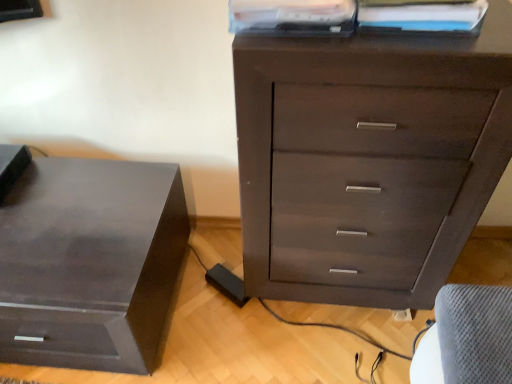
In order to click on matte plastic book at upper center, which is the first book in left-to-right order in this screenshot , I will do `click(293, 17)`.

Describe the element at coordinates (368, 160) in the screenshot. This screenshot has width=512, height=384. I see `dark wood chest of drawers at center` at that location.

Consider the image. What is the approximate width of matte black nightstand at left?

matte black nightstand at left is 26.99 inches wide.

The image size is (512, 384). I want to click on white paper at upper center, the second book viewed from the left, so click(x=421, y=14).

Could you tell me if white paper at upper center, positioned as the first book in right-to-left order, is turned towards matte plastic book at upper center, the 2th book in the right-to-left sequence?

No.

Can you confirm if white paper at upper center, the second book viewed from the left, is bigger than matte plastic book at upper center, which is the first book in left-to-right order?

Actually, white paper at upper center, the second book viewed from the left, might be smaller than matte plastic book at upper center, which is the first book in left-to-right order.

Does point (433, 7) come farther from viewer compared to point (335, 5)?

Yes, it is behind point (335, 5).

Would you say white paper at upper center, positioned as the first book in right-to-left order, is inside or outside matte plastic book at upper center, the 2th book in the right-to-left sequence?

white paper at upper center, positioned as the first book in right-to-left order, is outside matte plastic book at upper center, the 2th book in the right-to-left sequence.

Is matte plastic book at upper center, the 2th book in the right-to-left sequence, spatially inside white paper at upper center, positioned as the first book in right-to-left order, or outside of it?

matte plastic book at upper center, the 2th book in the right-to-left sequence, is not inside white paper at upper center, positioned as the first book in right-to-left order, it's outside.

Is white paper at upper center, positioned as the first book in right-to-left order, at the back of matte plastic book at upper center, the 2th book in the right-to-left sequence?

No, matte plastic book at upper center, the 2th book in the right-to-left sequence, is not facing away from white paper at upper center, positioned as the first book in right-to-left order.

From the image's perspective, between matte plastic book at upper center, the 2th book in the right-to-left sequence, and white paper at upper center, the second book viewed from the left, who is located below?

white paper at upper center, the second book viewed from the left.

Which is more to the right, matte plastic book at upper center, which is the first book in left-to-right order, or white paper at upper center, the second book viewed from the left?

Positioned to the right is white paper at upper center, the second book viewed from the left.

Considering the points (400, 13) and (130, 233), which point is behind, point (400, 13) or point (130, 233)?

Point (130, 233)

How many degrees apart are the facing directions of white paper at upper center, positioned as the first book in right-to-left order, and matte black nightstand at left?

white paper at upper center, positioned as the first book in right-to-left order, and matte black nightstand at left are facing 1.21 degrees away from each other.

From the image's perspective, is white paper at upper center, the second book viewed from the left, under matte black nightstand at left?

No, from the image's perspective, white paper at upper center, the second book viewed from the left, is not below matte black nightstand at left.

From the picture: Is white paper at upper center, positioned as the first book in right-to-left order, to the right of matte black nightstand at left from the viewer's perspective?

Indeed, white paper at upper center, positioned as the first book in right-to-left order, is positioned on the right side of matte black nightstand at left.

Locate an element on the screen. This screenshot has height=384, width=512. chest of drawers to the left of white paper at upper center, the second book viewed from the left is located at coordinates (368, 160).

Is dark wood chest of drawers at center to the left or to the right of white paper at upper center, the second book viewed from the left, in the image?

From the image, it's evident that dark wood chest of drawers at center is to the left of white paper at upper center, the second book viewed from the left.

Which of these two, dark wood chest of drawers at center or white paper at upper center, positioned as the first book in right-to-left order, is bigger?

dark wood chest of drawers at center is bigger.

Is dark wood chest of drawers at center positioned with its back to white paper at upper center, positioned as the first book in right-to-left order?

dark wood chest of drawers at center is not turned away from white paper at upper center, positioned as the first book in right-to-left order.

Who is shorter, matte black nightstand at left or matte plastic book at upper center, which is the first book in left-to-right order?

Standing shorter between the two is matte plastic book at upper center, which is the first book in left-to-right order.

In the scene shown: Which is behind, matte black nightstand at left or matte plastic book at upper center, the 2th book in the right-to-left sequence?

matte black nightstand at left is behind.

Is matte black nightstand at left next to matte plastic book at upper center, the 2th book in the right-to-left sequence, and touching it?

No, matte black nightstand at left is not beside matte plastic book at upper center, the 2th book in the right-to-left sequence.

Is matte black nightstand at left oriented away from matte plastic book at upper center, the 2th book in the right-to-left sequence?

No, matte black nightstand at left is not facing the opposite direction of matte plastic book at upper center, the 2th book in the right-to-left sequence.

Is white paper at upper center, the second book viewed from the left, in contact with dark wood chest of drawers at center?

They are not placed beside each other.

Could you tell me if white paper at upper center, positioned as the first book in right-to-left order, is facing dark wood chest of drawers at center?

No, white paper at upper center, positioned as the first book in right-to-left order, is not facing towards dark wood chest of drawers at center.

Considering the sizes of objects white paper at upper center, the second book viewed from the left, and dark wood chest of drawers at center in the image provided, who is taller, white paper at upper center, the second book viewed from the left, or dark wood chest of drawers at center?

Standing taller between the two is dark wood chest of drawers at center.

Is white paper at upper center, positioned as the first book in right-to-left order, not within dark wood chest of drawers at center?

That's correct, white paper at upper center, positioned as the first book in right-to-left order, is outside of dark wood chest of drawers at center.

From the picture: From the image's perspective, is matte plastic book at upper center, the 2th book in the right-to-left sequence, above or below matte black nightstand at left?

matte plastic book at upper center, the 2th book in the right-to-left sequence, is situated higher than matte black nightstand at left in the image.

Is matte black nightstand at left at the back of matte plastic book at upper center, which is the first book in left-to-right order?

No, matte black nightstand at left is not at the back of matte plastic book at upper center, which is the first book in left-to-right order.

Considering the positions of objects matte plastic book at upper center, the 2th book in the right-to-left sequence, and matte black nightstand at left in the image provided, who is more to the right, matte plastic book at upper center, the 2th book in the right-to-left sequence, or matte black nightstand at left?

From the viewer's perspective, matte plastic book at upper center, the 2th book in the right-to-left sequence, appears more on the right side.

Are matte plastic book at upper center, the 2th book in the right-to-left sequence, and matte black nightstand at left beside each other?

matte plastic book at upper center, the 2th book in the right-to-left sequence, and matte black nightstand at left are not in contact.

At what (x,y) coordinates should I click in order to perform the action: click on book lying in front of the white paper at upper center, positioned as the first book in right-to-left order. Please return your answer as a coordinate pair (x, y). Image resolution: width=512 pixels, height=384 pixels. Looking at the image, I should click on (293, 17).

Locate an element on the screen. This screenshot has height=384, width=512. book that appears below the matte plastic book at upper center, which is the first book in left-to-right order (from the image's perspective) is located at coordinates (421, 14).

Considering their positions, is matte plastic book at upper center, the 2th book in the right-to-left sequence, positioned closer to matte black nightstand at left than white paper at upper center, positioned as the first book in right-to-left order?

matte plastic book at upper center, the 2th book in the right-to-left sequence, is closer to matte black nightstand at left.

Estimate the real-world distances between objects in this image. Which object is further from matte black nightstand at left, dark wood chest of drawers at center or white paper at upper center, positioned as the first book in right-to-left order?

The object further to matte black nightstand at left is white paper at upper center, positioned as the first book in right-to-left order.

When comparing their distances from matte black nightstand at left, does matte plastic book at upper center, which is the first book in left-to-right order, or dark wood chest of drawers at center seem further?

matte plastic book at upper center, which is the first book in left-to-right order, is further to matte black nightstand at left.

From the image, which object appears to be farther from matte plastic book at upper center, the 2th book in the right-to-left sequence, dark wood chest of drawers at center or white paper at upper center, positioned as the first book in right-to-left order?

dark wood chest of drawers at center.

Based on their spatial positions, is dark wood chest of drawers at center or matte plastic book at upper center, which is the first book in left-to-right order, further from matte black nightstand at left?

The object further to matte black nightstand at left is matte plastic book at upper center, which is the first book in left-to-right order.

Looking at the image, which one is located closer to white paper at upper center, positioned as the first book in right-to-left order, matte plastic book at upper center, the 2th book in the right-to-left sequence, or matte black nightstand at left?

The object closer to white paper at upper center, positioned as the first book in right-to-left order, is matte plastic book at upper center, the 2th book in the right-to-left sequence.

Estimate the real-world distances between objects in this image. Which object is further from dark wood chest of drawers at center, matte black nightstand at left or matte plastic book at upper center, which is the first book in left-to-right order?

matte black nightstand at left lies further to dark wood chest of drawers at center than the other object.

Looking at this image, based on their spatial positions, is matte black nightstand at left or matte plastic book at upper center, the 2th book in the right-to-left sequence, further from white paper at upper center, positioned as the first book in right-to-left order?

matte black nightstand at left lies further to white paper at upper center, positioned as the first book in right-to-left order, than the other object.

The image size is (512, 384). I want to click on chest of drawers between matte black nightstand at left and white paper at upper center, the second book viewed from the left, in the horizontal direction, so click(368, 160).

This screenshot has width=512, height=384. What are the coordinates of `book between matte plastic book at upper center, the 2th book in the right-to-left sequence, and dark wood chest of drawers at center, in the vertical direction` in the screenshot? It's located at (421, 14).

Identify the location of book between matte black nightstand at left and dark wood chest of drawers at center. (293, 17).

In order to click on book between matte black nightstand at left and white paper at upper center, positioned as the first book in right-to-left order, in the horizontal direction in this screenshot , I will do `click(293, 17)`.